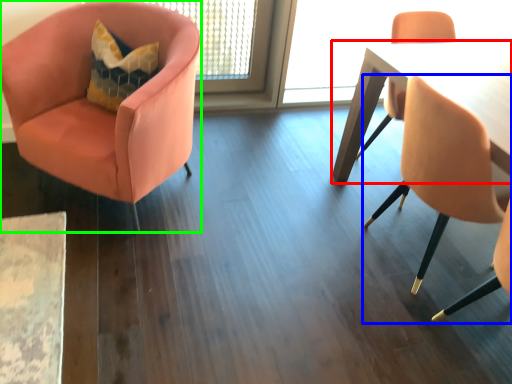
Question: Estimate the real-world distances between objects in this image. Which object is farther from table (highlighted by a red box), chair (highlighted by a blue box) or chair (highlighted by a green box)?

Choices:
 (A) chair
 (B) chair

Answer: (B)